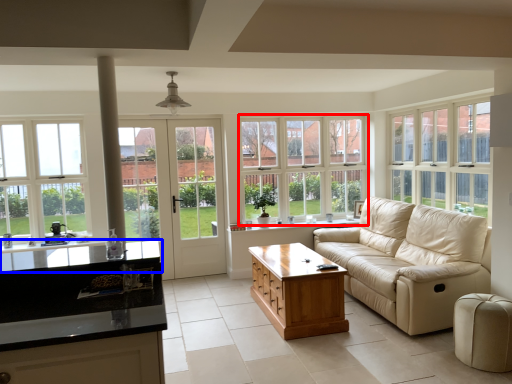
Question: Among these objects, which one is nearest to the camera, window (highlighted by a red box) or countertop (highlighted by a blue box)?

Choices:
 (A) window
 (B) countertop

Answer: (B)